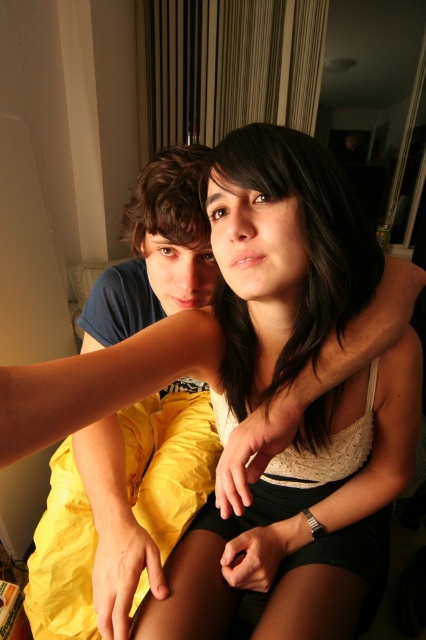
Does matte blue shirt at left have a greater width compared to smooth dark hair at center?

Yes.

Can you confirm if matte blue shirt at left is positioned to the left of smooth dark hair at center?

Indeed, matte blue shirt at left is positioned on the left side of smooth dark hair at center.

Locate an element on the screen. matte blue shirt at left is located at coordinates click(155, 252).